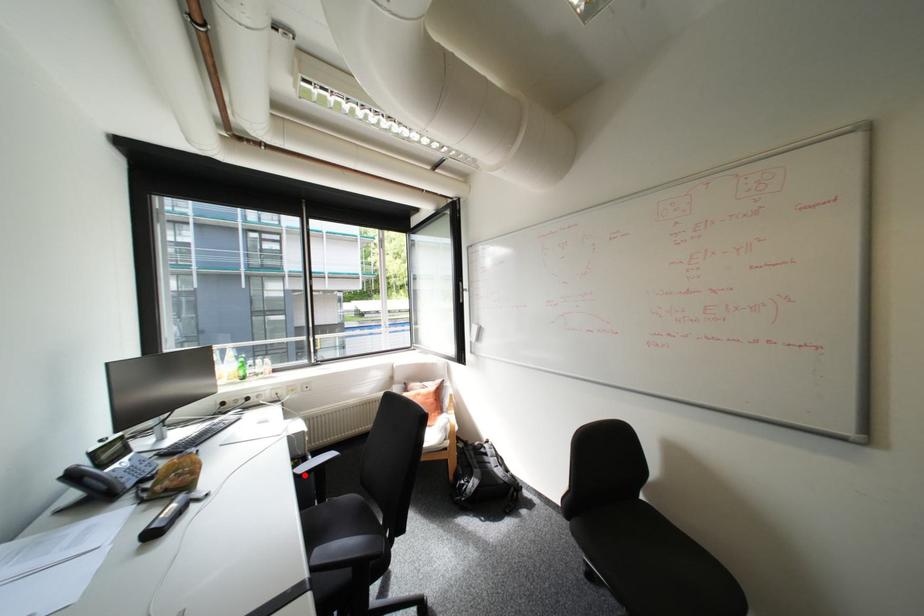
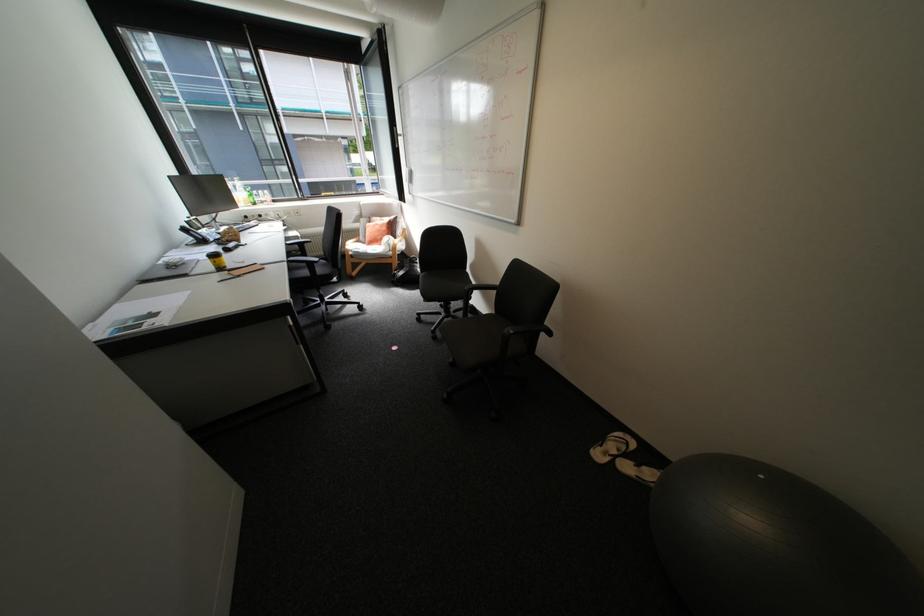
Question: I am providing you with two images of the same scene from different viewpoints. A red point is shown in image1. For the corresponding object point in image2, is it positioned nearer or farther from the camera?

Choices:
 (A) Nearer
 (B) Farther

Answer: (A)